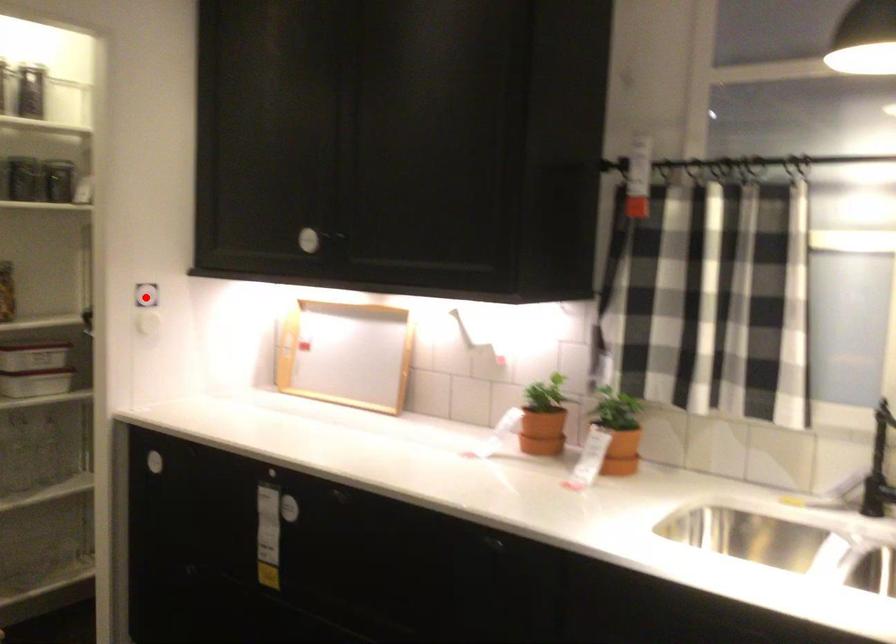
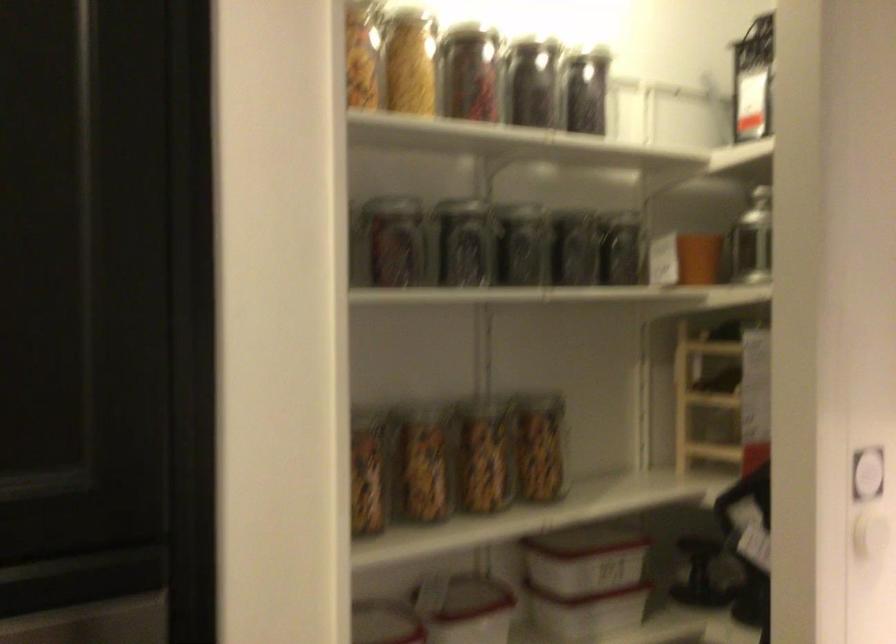
Question: I am providing you with two images of the same scene from different viewpoints. A red point is shown in image1. For the corresponding object point in image2, is it positioned nearer or farther from the camera?

Choices:
 (A) Nearer
 (B) Farther

Answer: (A)